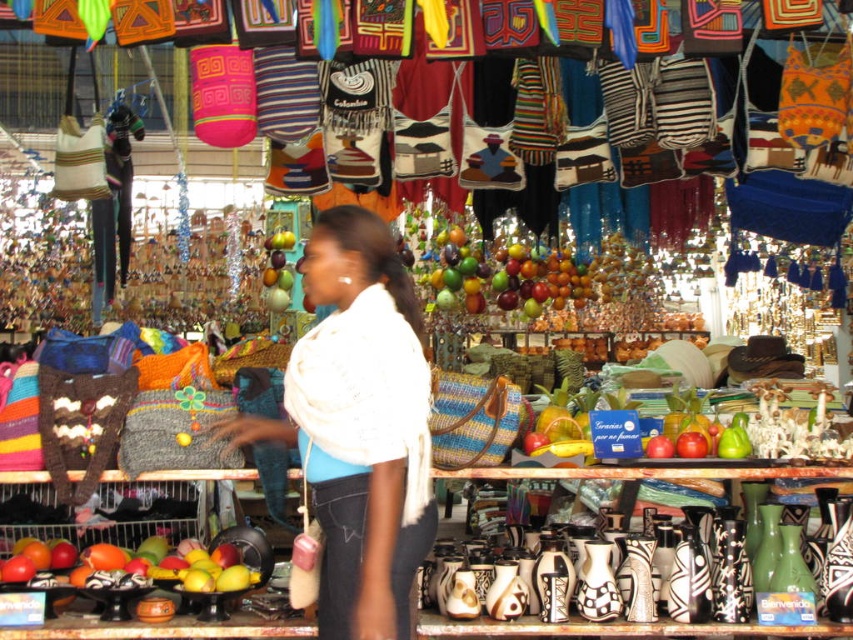
Looking at this image, does white soft scarf at center have a lesser height compared to mangoes at center?

In fact, white soft scarf at center may be taller than mangoes at center.

Does point (331, 566) come in front of point (131, 564)?

Yes, it is.

The height and width of the screenshot is (640, 853). Identify the location of white soft scarf at center. (358, 426).

Does white soft scarf at center have a greater height compared to glossy plastic fruit at center?

Indeed, white soft scarf at center has a greater height compared to glossy plastic fruit at center.

Is point (374, 392) positioned before point (445, 237)?

That is True.

Where is `white soft scarf at center`? The width and height of the screenshot is (853, 640). white soft scarf at center is located at coordinates (358, 426).

Where is `glossy plastic fruit at center`? The image size is (853, 640). glossy plastic fruit at center is located at coordinates (500, 276).

The image size is (853, 640). Describe the element at coordinates (500, 276) in the screenshot. I see `glossy plastic fruit at center` at that location.

Where is `glossy plastic fruit at center`? The width and height of the screenshot is (853, 640). glossy plastic fruit at center is located at coordinates (500, 276).